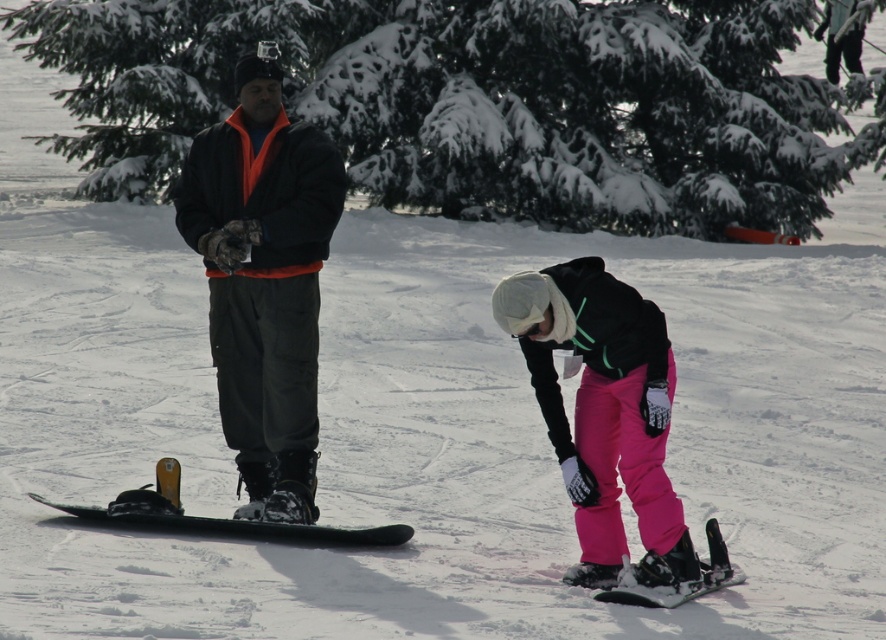
You are planning to take a photo of the snowboarders. The scene has a matte black snowboard at left and a green matte snowboard at center. According to the spatial arrangement, which snowboard is positioned closer to the right side of the image?

The matte black snowboard at left is positioned to the right of the green matte snowboard at center, making it closer to the right side of the image.